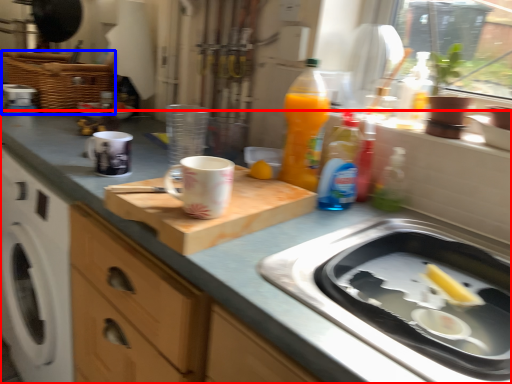
Question: Which object is closer to the camera taking this photo, countertop (highlighted by a red box) or basket (highlighted by a blue box)?

Choices:
 (A) countertop
 (B) basket

Answer: (A)